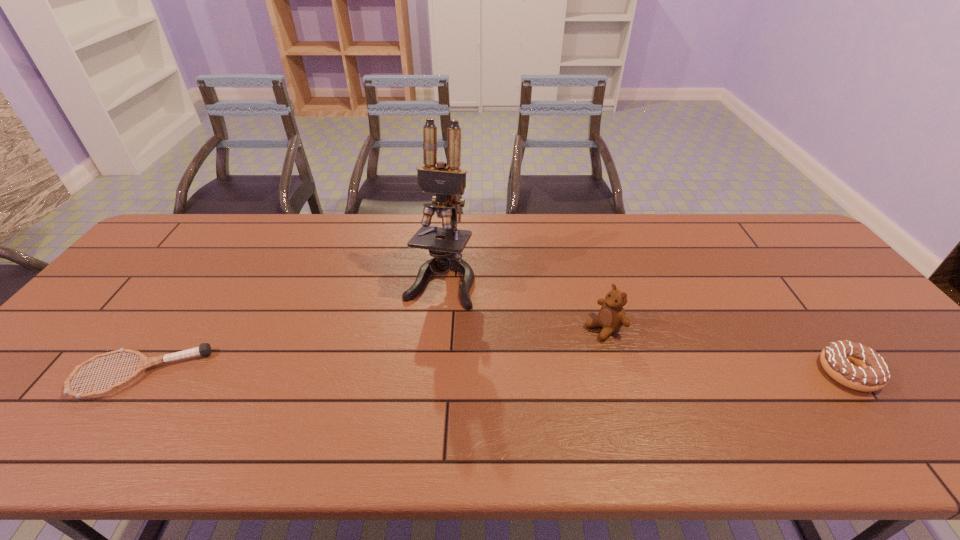
Find the location of a particular element. free space on the desktop that is between the shortest object and the doughnut and is positioned at the eyepieces of the microscope is located at coordinates (404, 374).

Locate an element on the screen. This screenshot has height=540, width=960. free space on the desktop that is between the leftmost object and the rightmost object and is positioned on the front-facing side of the second tallest object is located at coordinates (517, 373).